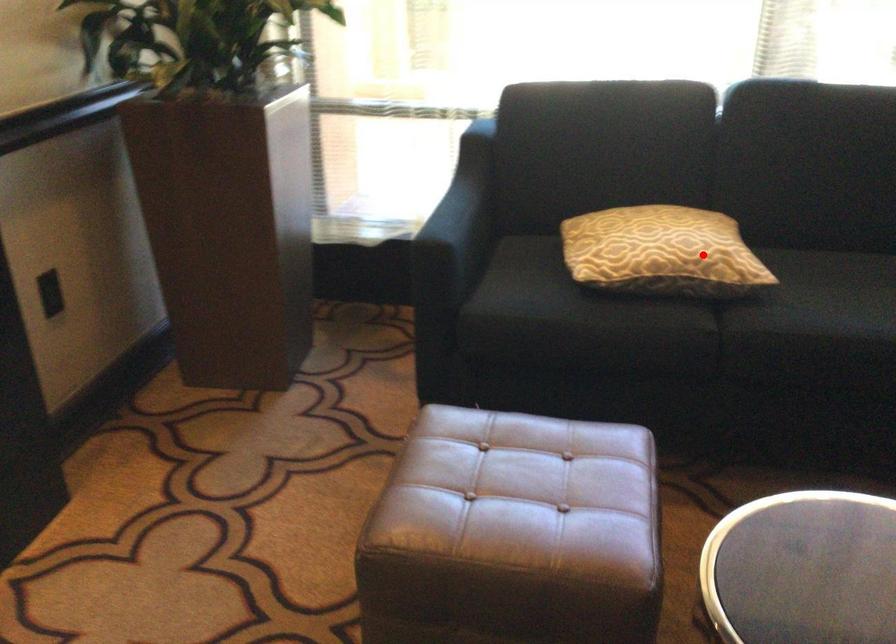
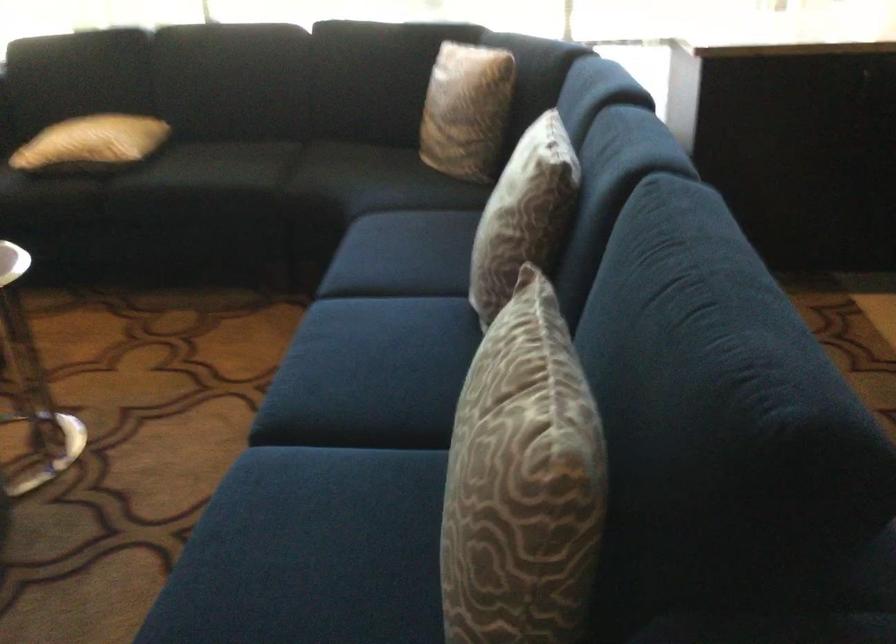
Question: I am providing you with two images of the same scene from different viewpoints. A red point is marked on the first image. At the location where the point appears in image 1, is it still visible in image 2?

Choices:
 (A) Yes
 (B) No

Answer: (A)